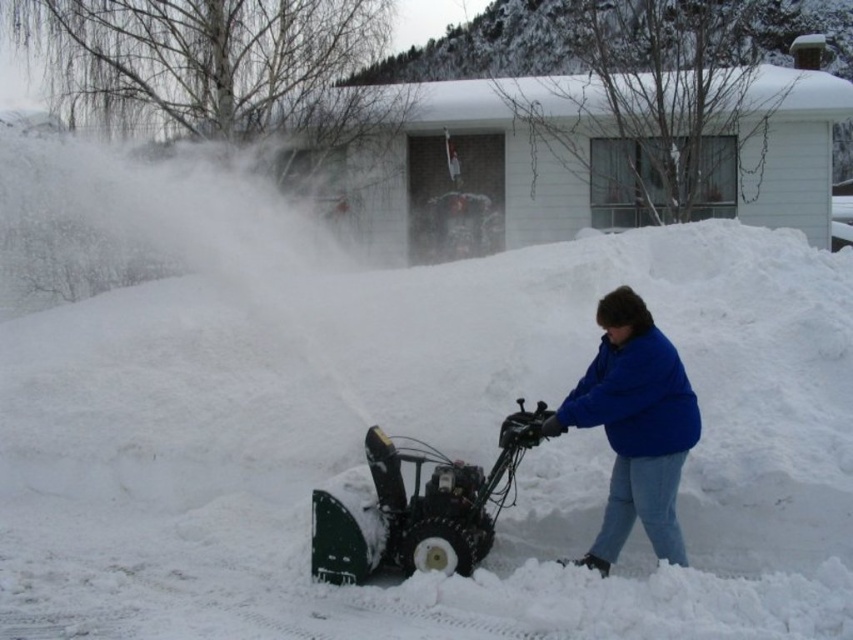
You are a delivery person trying to deliver a package to the house in the background. You see the white fluffy snow at center and the blue fleece jacket at lower right. Which object would you need to avoid stepping on to prevent slipping?

The white fluffy snow at center is larger in size than the blue fleece jacket at lower right, so you should avoid stepping on the white fluffy snow at center to prevent slipping.

You are standing at the edge of the driveway and see the blue fleece jacket at lower right and the green plastic snow blower at center. Which object is taller?

The blue fleece jacket at lower right is taller than the green plastic snow blower at center.